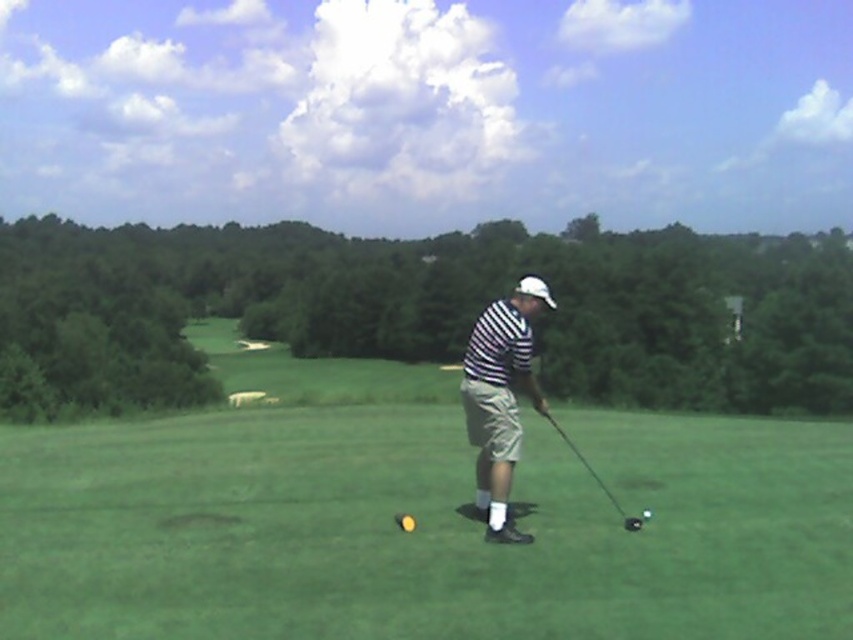
Does green grass at center appear on the left side of yellow matte golf ball at center?

No, green grass at center is not to the left of yellow matte golf ball at center.

Can you confirm if green grass at center is wider than yellow matte golf ball at center?

Correct, the width of green grass at center exceeds that of yellow matte golf ball at center.

Which is behind, point (751, 529) or point (398, 518)?

The point (398, 518) is more distant.

Identify the location of green grass at center. (416, 518).

Between striped fabric shirt at center and yellow matte golf ball at center, which one has less height?

yellow matte golf ball at center is shorter.

Does striped fabric shirt at center have a larger size compared to yellow matte golf ball at center?

Yes.

This screenshot has height=640, width=853. Identify the location of striped fabric shirt at center. (500, 397).

Find the location of a particular element. This screenshot has height=640, width=853. striped fabric shirt at center is located at coordinates coord(500,397).

Does striped cotton polo shirt at center come behind shiny black golf ball at center?

That is False.

Which is above, striped cotton polo shirt at center or shiny black golf ball at center?

striped cotton polo shirt at center is higher up.

You are a GUI agent. You are given a task and a screenshot of the screen. Output one action in this format:
    pyautogui.click(x=<x>, y=<y>)
    Task: Click on the striped cotton polo shirt at center
    This screenshot has width=853, height=640.
    Given the screenshot: What is the action you would take?
    pyautogui.click(x=498, y=344)